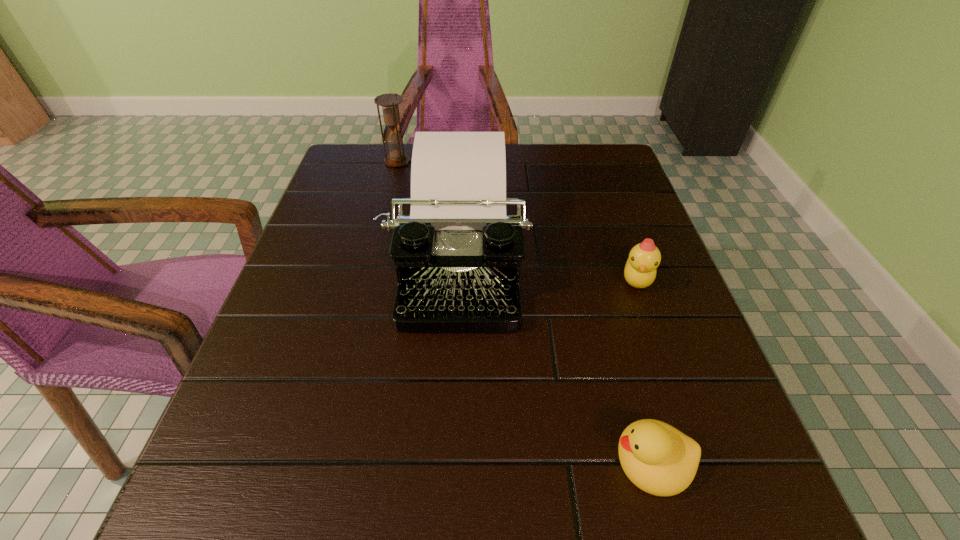
Identify which object is the nearest to the typewriter. Please provide its 2D coordinates. Your answer should be formatted as a tuple, i.e. [(x, y)], where the tuple contains the x and y coordinates of a point satisfying the conditions above.

[(389, 102)]

Choose which object is the nearest neighbor to the shortest object. Please provide its 2D coordinates. Your answer should be formatted as a tuple, i.e. [(x, y)], where the tuple contains the x and y coordinates of a point satisfying the conditions above.

[(457, 255)]

Where is `free spot that satisfies the following two spatial constraints: 1. on the front-facing side of the third tallest object; 2. on the face of the shorter duckling`? This screenshot has width=960, height=540. free spot that satisfies the following two spatial constraints: 1. on the front-facing side of the third tallest object; 2. on the face of the shorter duckling is located at coordinates (700, 461).

Where is `free region that satisfies the following two spatial constraints: 1. on the front-facing side of the taller duckling; 2. on the face of the nearest object`? This screenshot has width=960, height=540. free region that satisfies the following two spatial constraints: 1. on the front-facing side of the taller duckling; 2. on the face of the nearest object is located at coordinates click(700, 461).